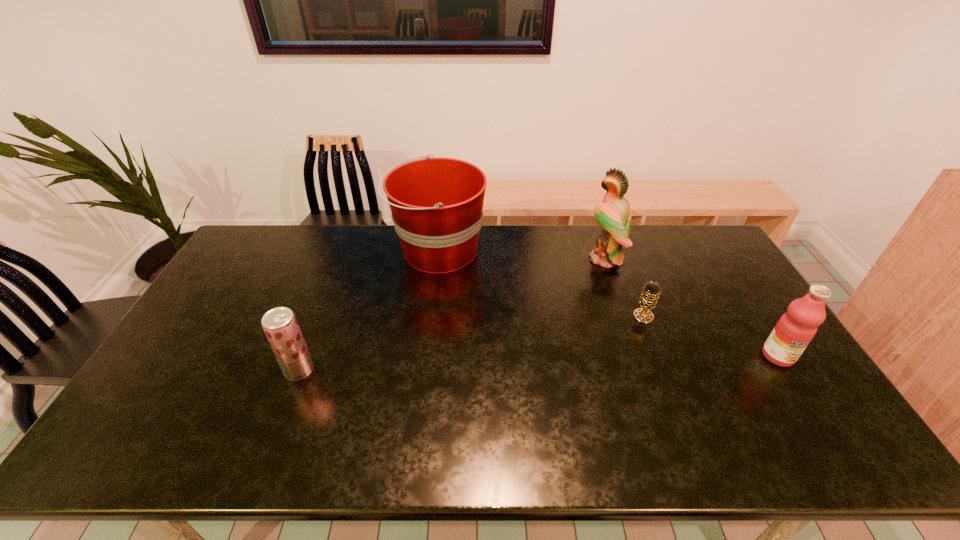
Locate an element on the screen. This screenshot has height=540, width=960. parrot is located at coordinates (614, 216).

Image resolution: width=960 pixels, height=540 pixels. I want to click on bucket, so (437, 203).

At what (x,y) coordinates should I click in order to perform the action: click on the third shortest object. Please return your answer as a coordinate pair (x, y). Looking at the image, I should click on (795, 329).

At what (x,y) coordinates should I click in order to perform the action: click on the taller fruit juice. Please return your answer as a coordinate pair (x, y). The height and width of the screenshot is (540, 960). Looking at the image, I should click on (795, 329).

Locate an element on the screen. Image resolution: width=960 pixels, height=540 pixels. the left fruit juice is located at coordinates (280, 325).

Find the location of a particular element. the leftmost object is located at coordinates (280, 325).

You are a GUI agent. You are given a task and a screenshot of the screen. Output one action in this format:
    pyautogui.click(x=<x>, y=<y>)
    Task: Click on the third nearest object
    The height and width of the screenshot is (540, 960).
    Given the screenshot: What is the action you would take?
    pyautogui.click(x=648, y=301)

Find the location of a particular element. The width and height of the screenshot is (960, 540). chalice is located at coordinates (648, 301).

The width and height of the screenshot is (960, 540). What are the coordinates of `vacant space located 0.050m on the front-facing side of the parrot` in the screenshot? It's located at (572, 259).

Identify the location of free space located 0.120m on the front-facing side of the parrot. The width and height of the screenshot is (960, 540). (553, 259).